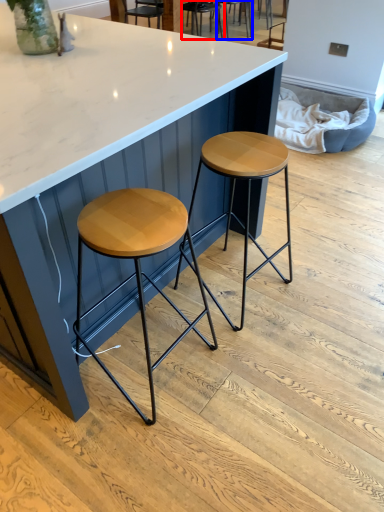
Question: Which object is further to the camera taking this photo, chair (highlighted by a red box) or chair (highlighted by a blue box)?

Choices:
 (A) chair
 (B) chair

Answer: (B)